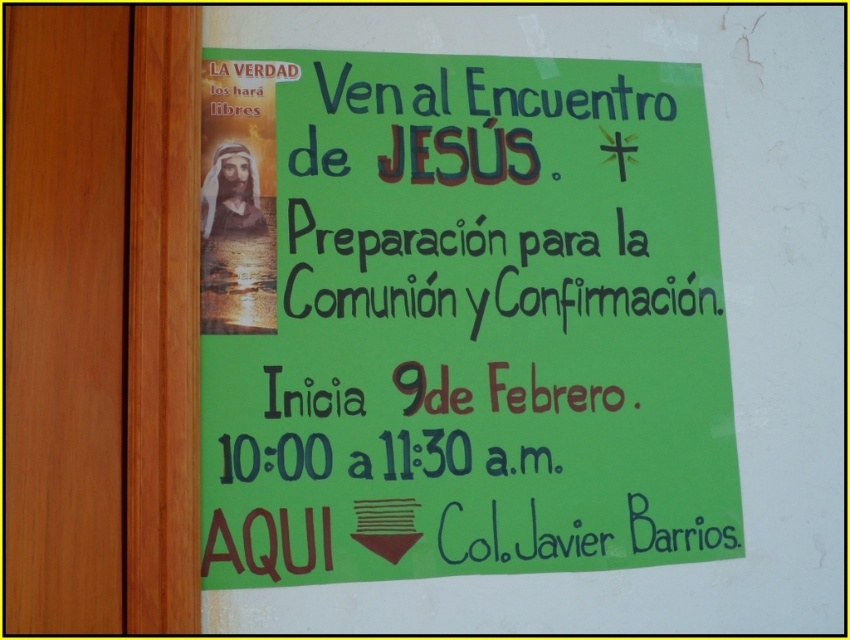
Is green paper poster at upper center above brown wood door at left?

Correct, green paper poster at upper center is located above brown wood door at left.

Does green paper poster at upper center have a greater height compared to brown wood door at left?

No, green paper poster at upper center is not taller than brown wood door at left.

Between point (511, 371) and point (26, 292), which one is positioned behind?

Point (511, 371)

The width and height of the screenshot is (850, 640). Find the location of `green paper poster at upper center`. green paper poster at upper center is located at coordinates (459, 317).